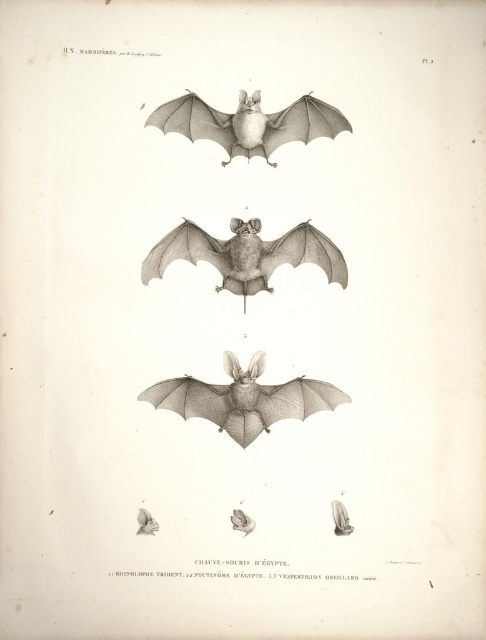
Describe the element at coordinates (243, 397) in the screenshot. I see `smooth gray bat at center` at that location.

Is point (173, 396) less distant than point (309, 120)?

Yes, it is.

In order to click on smooth gray bat at center in this screenshot , I will do `click(243, 397)`.

What do you see at coordinates (243, 397) in the screenshot? I see `smooth gray bat at center` at bounding box center [243, 397].

Is smooth gray bat at center taller than gray pencil sketch bat at center?

Yes, smooth gray bat at center is taller than gray pencil sketch bat at center.

What are the coordinates of `smooth gray bat at center` in the screenshot? It's located at (243, 397).

Can you confirm if gray pencil sketch bat at center is smaller than matte gray wing at upper center?

Incorrect, gray pencil sketch bat at center is not smaller in size than matte gray wing at upper center.

Does gray pencil sketch bat at center come in front of matte gray wing at upper center?

No, gray pencil sketch bat at center is behind matte gray wing at upper center.

The image size is (486, 640). In order to click on gray pencil sketch bat at center in this screenshot , I will do `click(245, 253)`.